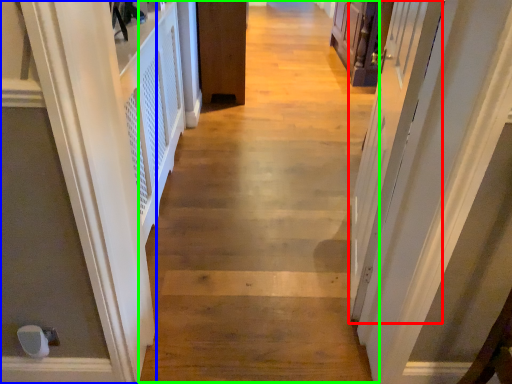
Question: Based on their relative distances, which object is farther from screen door (highlighted by a red box)? Choose from door (highlighted by a blue box) and path (highlighted by a green box).

Choices:
 (A) door
 (B) path

Answer: (A)